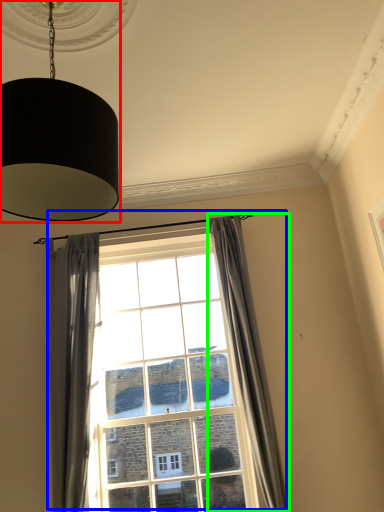
Question: Based on their relative distances, which object is farther from lamp (highlighted by a red box)? Choose from window (highlighted by a blue box) and curtain (highlighted by a green box).

Choices:
 (A) window
 (B) curtain

Answer: (A)